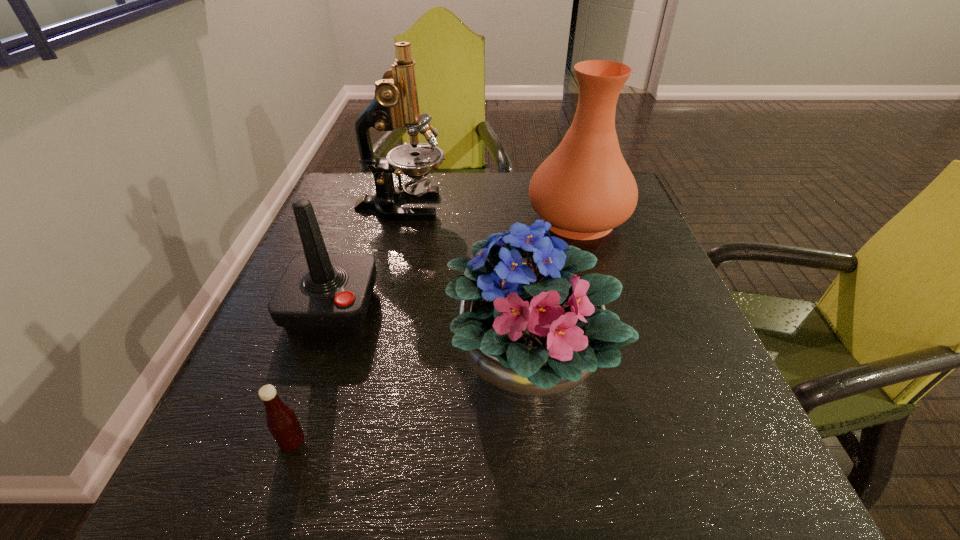
Locate an element on the screen. free space at the left edge of the desktop is located at coordinates (304, 385).

In the image, there is a desktop. Where is `free space at the right edge`? The width and height of the screenshot is (960, 540). free space at the right edge is located at coordinates tap(749, 435).

Where is `vacant space at the far left corner`? This screenshot has width=960, height=540. vacant space at the far left corner is located at coordinates (350, 181).

Identify the location of vacant space at the near right corner of the desktop. The image size is (960, 540). (708, 474).

Where is `free space that is in between the bouquet and the shortest object`? This screenshot has width=960, height=540. free space that is in between the bouquet and the shortest object is located at coordinates (410, 403).

The image size is (960, 540). I want to click on blank region between the vase and the Tabasco sauce, so click(x=435, y=331).

Identify the location of free area in between the vase and the Tabasco sauce. Image resolution: width=960 pixels, height=540 pixels. (435, 331).

Where is `vacant area that lies between the shortest object and the vase`? vacant area that lies between the shortest object and the vase is located at coordinates (435, 331).

Locate an element on the screen. Image resolution: width=960 pixels, height=540 pixels. vacant area that lies between the joystick and the Tabasco sauce is located at coordinates (312, 375).

Where is `free spot between the vase and the microscope`? free spot between the vase and the microscope is located at coordinates (490, 213).